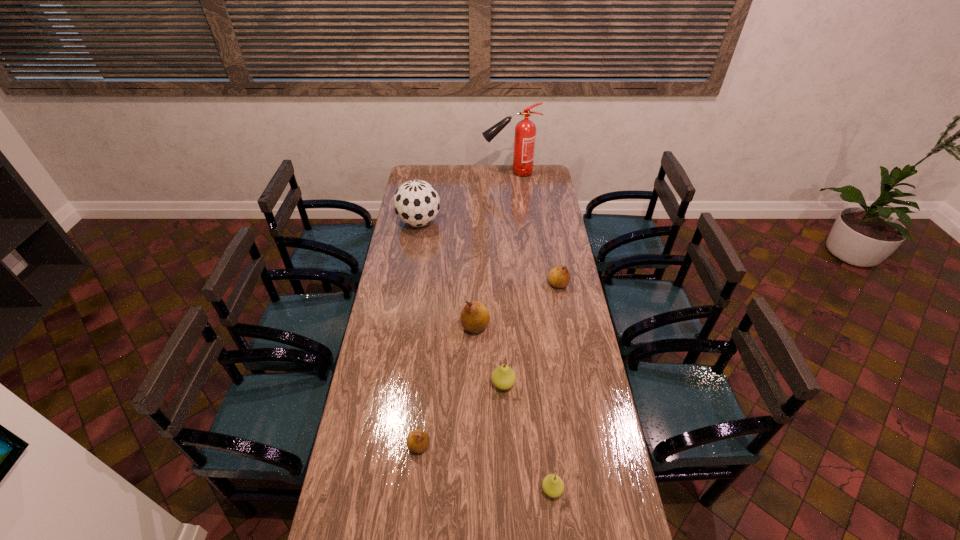
This screenshot has height=540, width=960. In order to click on vacant space situated on the left of the third pear from right to left in this screenshot , I will do `click(389, 384)`.

Locate an element on the screen. The image size is (960, 540). vacant space located on the back of the nearest object is located at coordinates (549, 463).

Identify the location of vacant space located on the right of the leftmost pear. This screenshot has height=540, width=960. (467, 446).

Identify the location of object located in the far edge section of the desktop. Image resolution: width=960 pixels, height=540 pixels. (525, 131).

The height and width of the screenshot is (540, 960). Identify the location of object at the left edge. (416, 203).

Locate an element on the screen. fire extinguisher that is at the right edge is located at coordinates (525, 131).

Where is `pear situated at the right edge`? Image resolution: width=960 pixels, height=540 pixels. pear situated at the right edge is located at coordinates (559, 277).

Where is `object at the far right corner`? object at the far right corner is located at coordinates (525, 131).

Identify the location of vacant space at the left edge of the desktop. click(396, 427).

This screenshot has height=540, width=960. Identify the location of blank space at the right edge of the desktop. (589, 394).